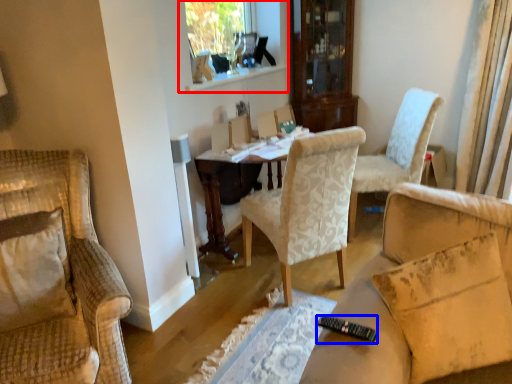
Question: Which point is closer to the camera, window frame (highlighted by a red box) or remote control (highlighted by a blue box)?

Choices:
 (A) window frame
 (B) remote control

Answer: (B)